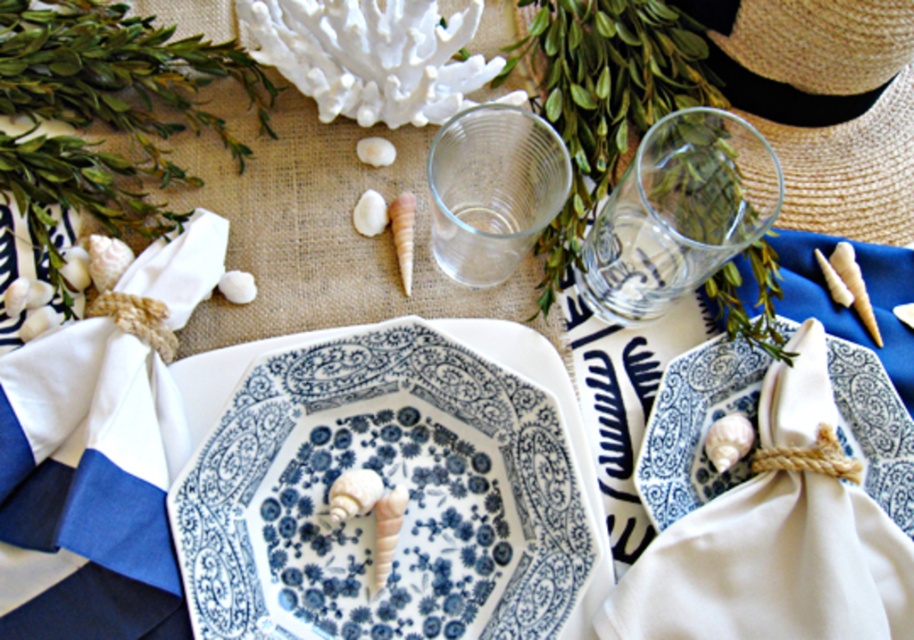
Between point (843, 161) and point (711, 236), which one is positioned in front?

Point (711, 236)

Which is behind, point (792, 45) or point (678, 177)?

Point (792, 45)

You are a GUI agent. You are given a task and a screenshot of the screen. Output one action in this format:
    pyautogui.click(x=<x>, y=<y>)
    Task: Click on the straw hat at upper right
    The width and height of the screenshot is (914, 640).
    Given the screenshot: What is the action you would take?
    pyautogui.click(x=824, y=104)

The height and width of the screenshot is (640, 914). What do you see at coordinates (391, 486) in the screenshot? I see `blue and white porcelain platter at center` at bounding box center [391, 486].

Based on the photo, who is lower down, blue and white porcelain platter at center or straw hat at upper right?

blue and white porcelain platter at center

Find the location of a particular element. The height and width of the screenshot is (640, 914). blue and white porcelain platter at center is located at coordinates (391, 486).

Between point (900, 81) and point (457, 129), which one is positioned behind?

The point (900, 81) is behind.

The height and width of the screenshot is (640, 914). What do you see at coordinates (824, 104) in the screenshot? I see `straw hat at upper right` at bounding box center [824, 104].

Does point (909, 120) come closer to viewer compared to point (555, 186)?

No, it is not.

Locate an element on the screen. straw hat at upper right is located at coordinates (824, 104).